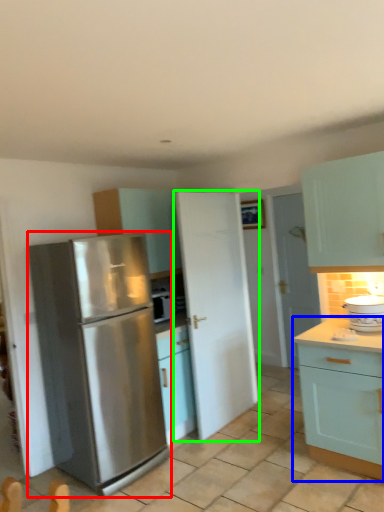
Question: Which object is the closest to the refrigerator (highlighted by a red box)? Choose among these: cabinetry (highlighted by a blue box) or door (highlighted by a green box).

Choices:
 (A) cabinetry
 (B) door

Answer: (B)